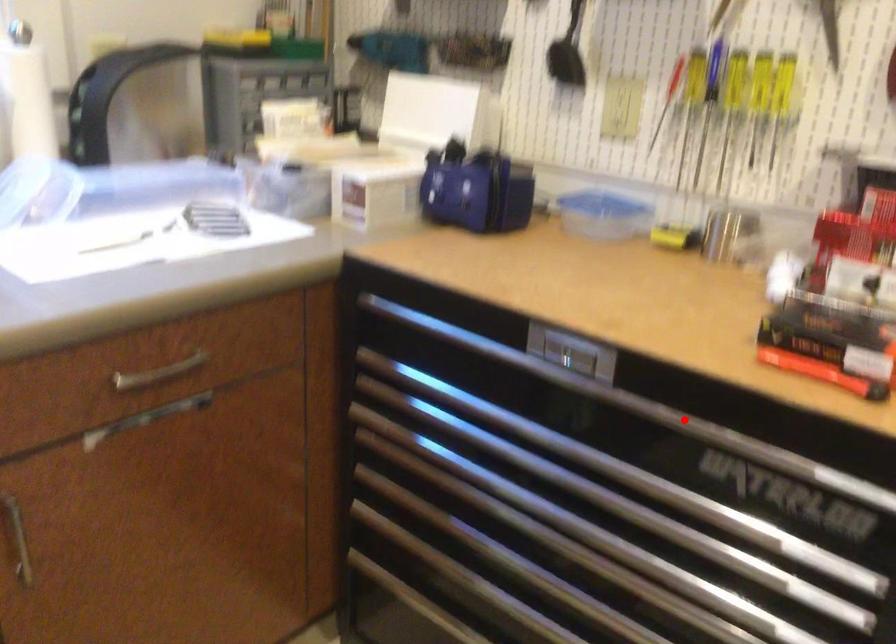
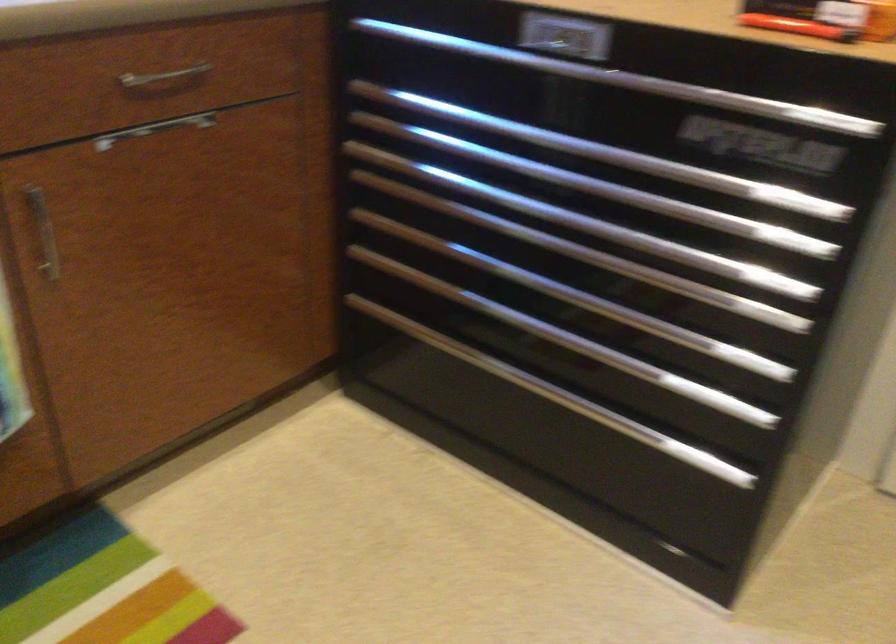
Find the pixel in the second image that matches the highlighted location in the first image.

(668, 88)